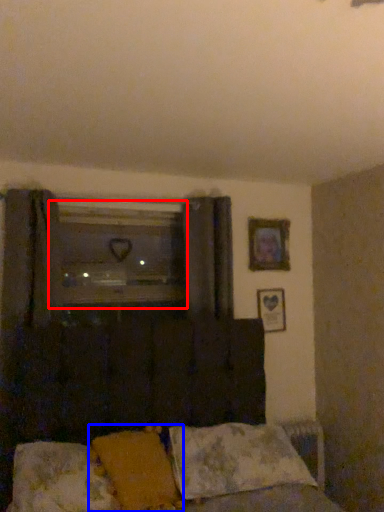
Question: Which of the following is the farthest to the observer, window (highlighted by a red box) or pillow (highlighted by a blue box)?

Choices:
 (A) window
 (B) pillow

Answer: (A)